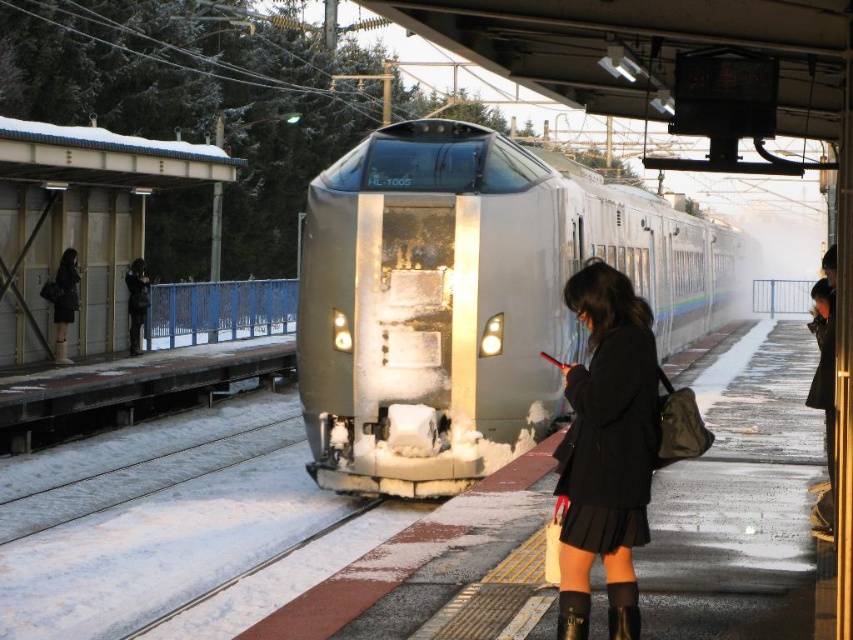
Is matte black coat at left positioned before brown suede boot at lower center?

No, matte black coat at left is behind brown suede boot at lower center.

Where is `matte black coat at left`? Image resolution: width=853 pixels, height=640 pixels. matte black coat at left is located at coordinates (64, 300).

You are a GUI agent. You are given a task and a screenshot of the screen. Output one action in this format:
    pyautogui.click(x=<x>, y=<y>)
    Task: Click on the matte black coat at left
    This screenshot has height=640, width=853.
    Given the screenshot: What is the action you would take?
    pyautogui.click(x=64, y=300)

Who is positioned more to the left, sleek silver train at center or black leather boot at lower center?

From the viewer's perspective, black leather boot at lower center appears more on the left side.

Can you confirm if sleek silver train at center is shorter than black leather boot at lower center?

No, sleek silver train at center is not shorter than black leather boot at lower center.

Is point (445, 253) farther from viewer compared to point (573, 637)?

Yes, it is behind point (573, 637).

Image resolution: width=853 pixels, height=640 pixels. In order to click on sleek silver train at center in this screenshot , I will do `click(468, 298)`.

Can you confirm if matte black coat at left is positioned below black leather boot at lower center?

No.

Who is taller, matte black coat at left or black leather boot at lower center?

matte black coat at left

Is point (68, 308) farther from camera compared to point (560, 621)?

Yes, point (68, 308) is behind point (560, 621).

Image resolution: width=853 pixels, height=640 pixels. In order to click on matte black coat at left in this screenshot , I will do `click(64, 300)`.